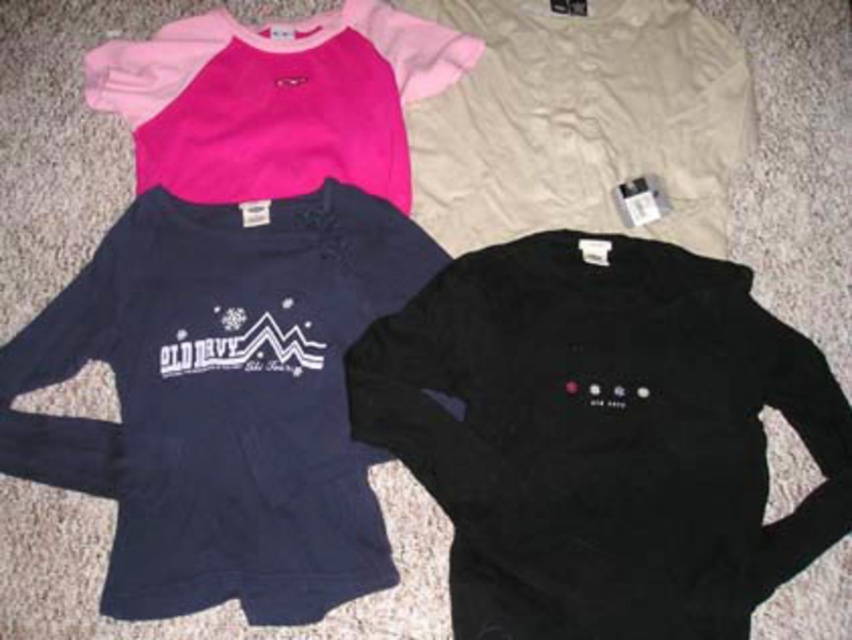
You are trying to organize your closet and need to know if there is enough space between the black fleece sweatshirt at lower right and the navy fleece sweatshirt at upper left to place a 20 cm wide scarf. Can you fit the scarf between them?

The black fleece sweatshirt at lower right and navy fleece sweatshirt at upper left are 23.74 centimeters apart, which is wider than the 20 cm scarf. Therefore, the scarf can fit between them.

You are looking at two fleece sweatshirts on a carpeted surface. The navy fleece sweatshirt at upper left and the pink fleece sweatshirt at upper left. Which one is nearer to you?

The navy fleece sweatshirt at upper left is closer to the viewer than the pink fleece sweatshirt at upper left.